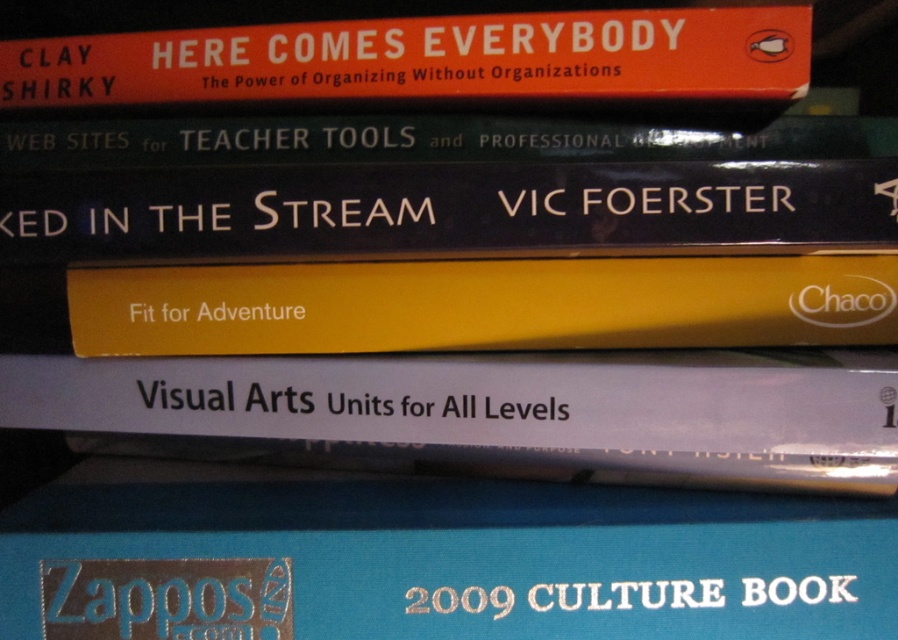
Can you confirm if blue hardcover book at lower center is wider than green matte book at center?

No.

Can you confirm if blue hardcover book at lower center is taller than green matte book at center?

Indeed, blue hardcover book at lower center has a greater height compared to green matte book at center.

Image resolution: width=898 pixels, height=640 pixels. Describe the element at coordinates (433, 557) in the screenshot. I see `blue hardcover book at lower center` at that location.

Locate an element on the screen. The height and width of the screenshot is (640, 898). blue hardcover book at lower center is located at coordinates (433, 557).

Does blue hardcover book at lower center come behind yellow matte book at center?

That is False.

Is point (386, 556) closer to camera compared to point (104, 349)?

Yes.

What do you see at coordinates (433, 557) in the screenshot? This screenshot has width=898, height=640. I see `blue hardcover book at lower center` at bounding box center [433, 557].

Where is `blue hardcover book at lower center`? This screenshot has height=640, width=898. blue hardcover book at lower center is located at coordinates (433, 557).

Who is higher up, white paper at center or yellow matte book at center?

yellow matte book at center is higher up.

Who is positioned more to the left, white paper at center or yellow matte book at center?

white paper at center

Is point (789, 380) less distant than point (331, 333)?

Yes, it is in front of point (331, 333).

At what (x,y) coordinates should I click in order to perform the action: click on white paper at center. Please return your answer as a coordinate pair (x, y). The width and height of the screenshot is (898, 640). Looking at the image, I should click on (505, 408).